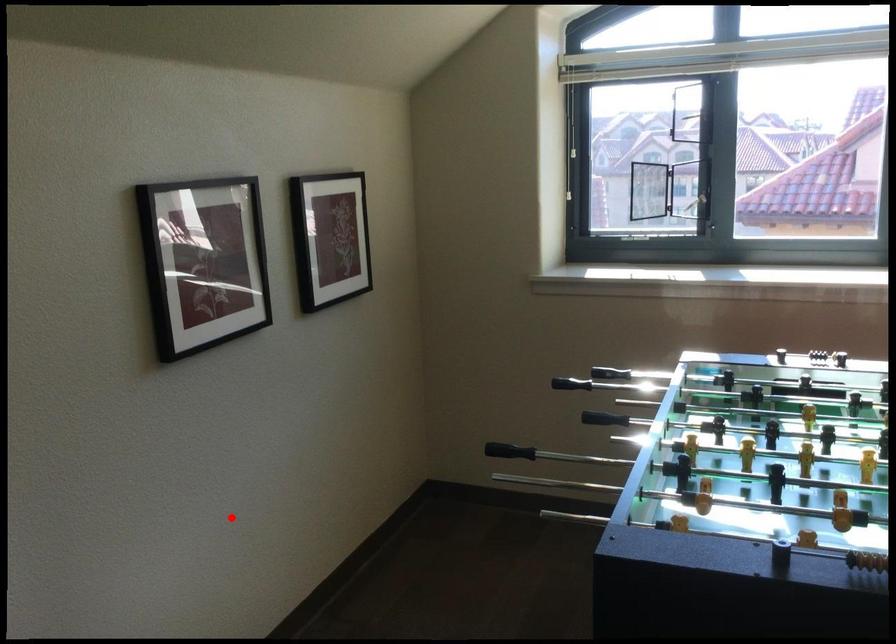
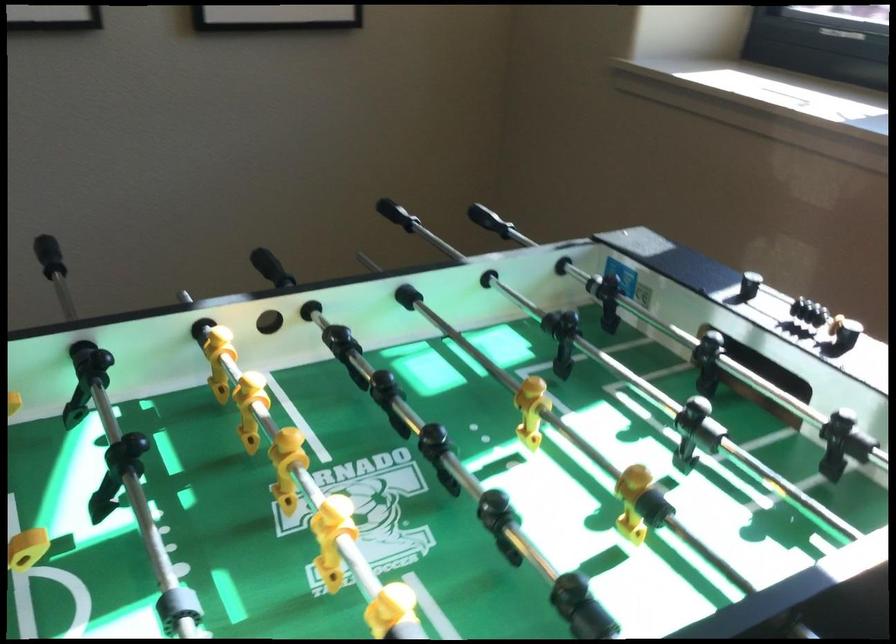
Question: I am providing you with two images of the same scene from different viewpoints. A red point is shown in image1. For the corresponding object point in image2, is it positioned nearer or farther from the camera?

Choices:
 (A) Nearer
 (B) Farther

Answer: (A)